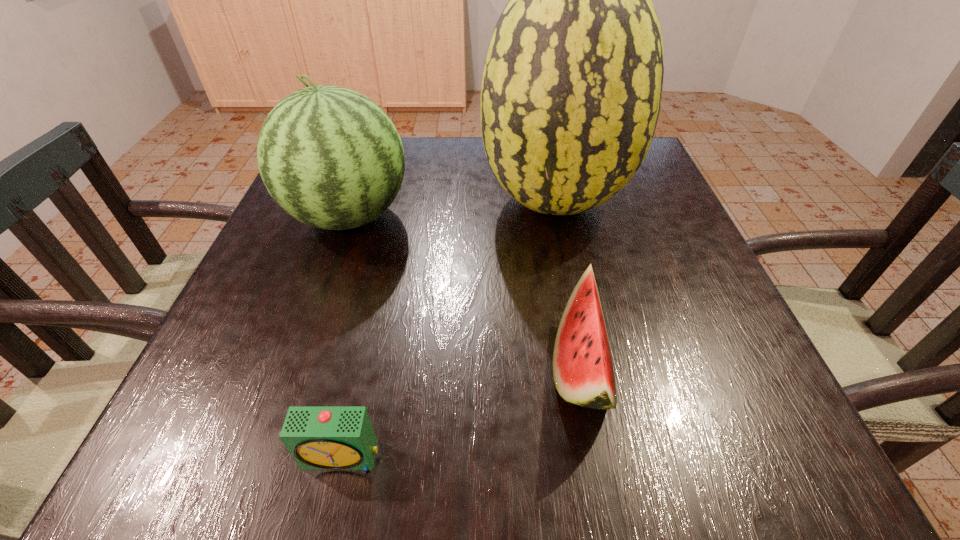
Find the location of a particular element. Image resolution: width=960 pixels, height=540 pixels. vacant space at the near left corner of the desktop is located at coordinates (208, 472).

Find the location of a particular element. This screenshot has width=960, height=540. vacant area between the second tallest object and the shortest watermelon is located at coordinates (465, 292).

Locate an element on the screen. The height and width of the screenshot is (540, 960). free space between the tallest watermelon and the nearest watermelon is located at coordinates click(x=568, y=284).

Locate an element on the screen. vacant point located between the tallest watermelon and the shortest object is located at coordinates pos(448,328).

Where is `unoccupied area between the tallest object and the nearest watermelon`? This screenshot has width=960, height=540. unoccupied area between the tallest object and the nearest watermelon is located at coordinates (568, 284).

Find the location of a particular element. The image size is (960, 540). empty location between the tallest object and the alarm clock is located at coordinates (448, 328).

Locate an element on the screen. The image size is (960, 540). free point between the tallest object and the shortest object is located at coordinates (448, 328).

What are the coordinates of `vacant point located between the tallest watermelon and the third shortest object` in the screenshot? It's located at (452, 208).

Identify the location of unoccupied position between the alarm clock and the tallest object. The width and height of the screenshot is (960, 540). (448, 328).

Identify the location of unoccupied area between the third shortest object and the shortest watermelon. Image resolution: width=960 pixels, height=540 pixels. (465, 292).